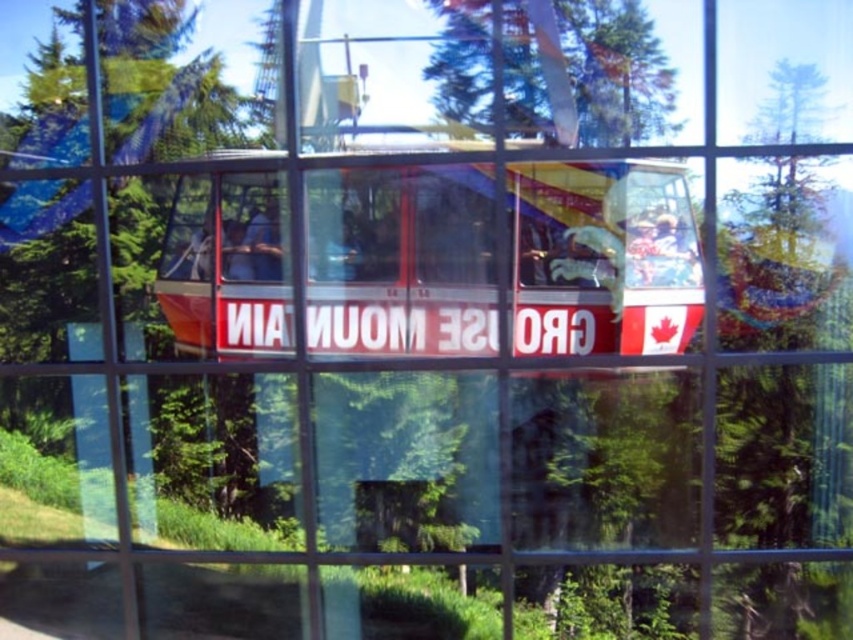
Question: Considering the relative positions of translucent glass decker bus at center and green leafy tree at upper center in the image provided, where is translucent glass decker bus at center located with respect to green leafy tree at upper center?

Choices:
 (A) above
 (B) below

Answer: (B)

Question: Which point is closer to the camera?

Choices:
 (A) (625, 202)
 (B) (659, 128)

Answer: (B)

Question: Is translucent glass decker bus at center closer to camera compared to green leafy tree at upper center?

Choices:
 (A) no
 (B) yes

Answer: (A)

Question: Which point is farther to the camera?

Choices:
 (A) (416, 349)
 (B) (546, 124)

Answer: (A)

Question: Is the position of translucent glass decker bus at center less distant than that of green leafy tree at upper center?

Choices:
 (A) no
 (B) yes

Answer: (A)